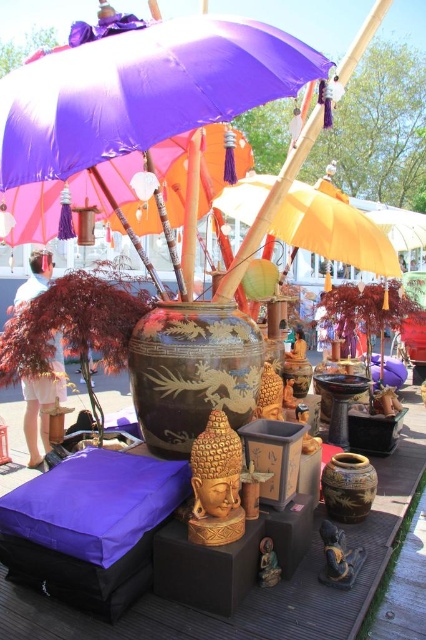
You are a customer at the market stall and want to buy both the purple fabric umbrella at upper center and the black glossy vase at center. If you look from the front of the stall, which object is positioned to the left?

The purple fabric umbrella at upper center is positioned to the left of the black glossy vase at center.

You are a delivery person who needs to place a new vase that is 2 feet wide between the black glossy vase at center and the brown textured vase at center. Can you fit it there?

The distance between the black glossy vase at center and the brown textured vase at center is 3.68 feet. Since the new vase is 2 feet wide, there is enough space to place it between them as 3.68 feet is greater than 2 feet.